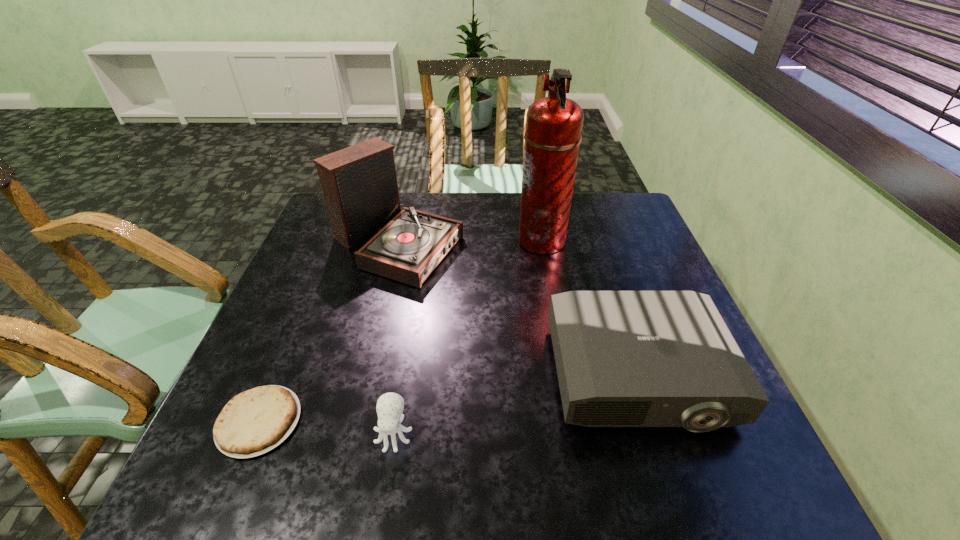
At what (x,y) coordinates should I click in order to perform the action: click on blank region between the shortest object and the second tallest object. Please return your answer as a coordinate pair (x, y). The width and height of the screenshot is (960, 540). Looking at the image, I should click on (328, 332).

The width and height of the screenshot is (960, 540). In order to click on vacant area that lies between the tortilla and the projector in this screenshot , I will do `click(448, 399)`.

At what (x,y) coordinates should I click in order to perform the action: click on vacant space that's between the phonograph record and the tortilla. Please return your answer as a coordinate pair (x, y). This screenshot has height=540, width=960. Looking at the image, I should click on (328, 332).

Select which object appears as the second closest to the octopus. Please provide its 2D coordinates. Your answer should be formatted as a tuple, i.e. [(x, y)], where the tuple contains the x and y coordinates of a point satisfying the conditions above.

[(624, 358)]

Locate an element on the screen. This screenshot has height=540, width=960. object that stands as the closest to the second shortest object is located at coordinates (254, 422).

Identify the location of vacant space that satisfies the following two spatial constraints: 1. on the back side of the tortilla; 2. on the left side of the second tallest object. (334, 242).